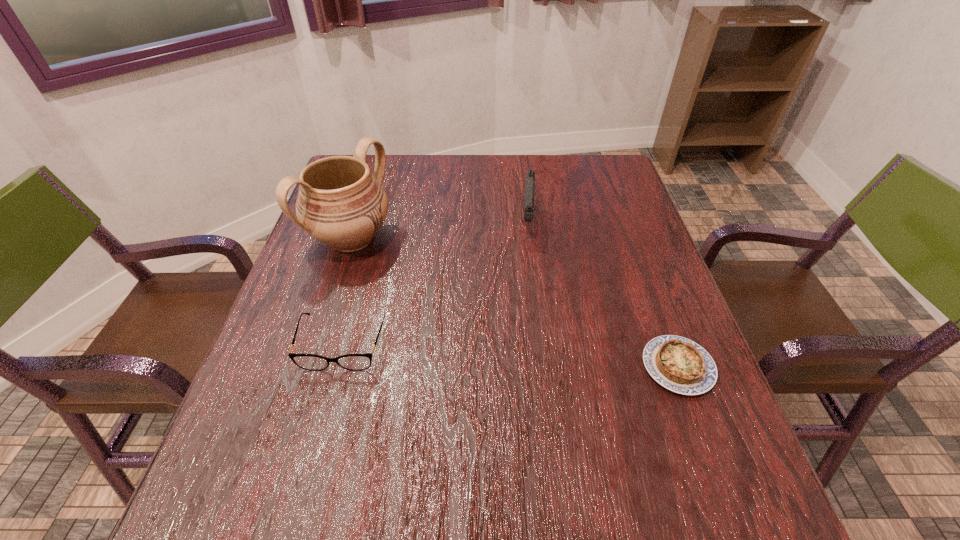
Locate an element on the screen. The width and height of the screenshot is (960, 540). the third tallest object is located at coordinates (355, 362).

The image size is (960, 540). In order to click on the shortest object in this screenshot , I will do `click(679, 364)`.

Locate an element on the screen. This screenshot has width=960, height=540. the rightmost object is located at coordinates (679, 364).

You are a GUI agent. You are given a task and a screenshot of the screen. Output one action in this format:
    pyautogui.click(x=<x>, y=<y>)
    Task: Click on the urn
    This screenshot has width=960, height=540.
    Given the screenshot: What is the action you would take?
    pyautogui.click(x=340, y=203)

Find the location of a particular element. The height and width of the screenshot is (540, 960). the second tallest object is located at coordinates (530, 174).

Identify the location of pistol. Image resolution: width=960 pixels, height=540 pixels. (530, 174).

Image resolution: width=960 pixels, height=540 pixels. I want to click on vacant area situated on the front-facing side of the spectacles, so click(x=321, y=428).

At what (x,y) coordinates should I click in order to perform the action: click on free space located 0.240m on the back of the quiche. Please return your answer as a coordinate pair (x, y). The height and width of the screenshot is (540, 960). Looking at the image, I should click on (638, 261).

The image size is (960, 540). Identify the location of free location located on the front-facing side of the tallest object. (511, 335).

This screenshot has width=960, height=540. I want to click on free space located on the front-facing side of the tallest object, so click(x=450, y=299).